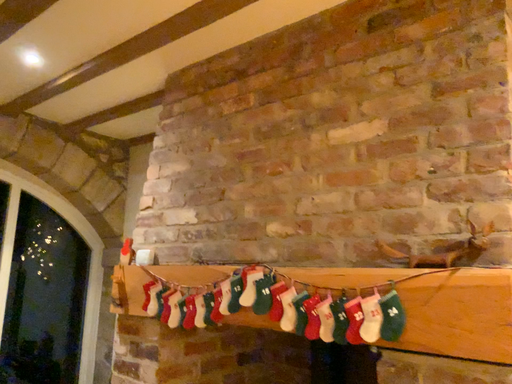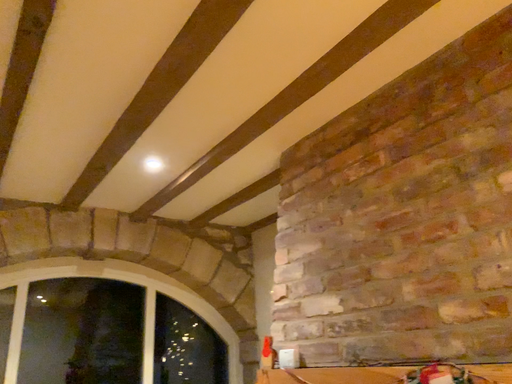
Question: How did the camera likely rotate when shooting the video?

Choices:
 (A) rotated downward
 (B) rotated upward

Answer: (B)